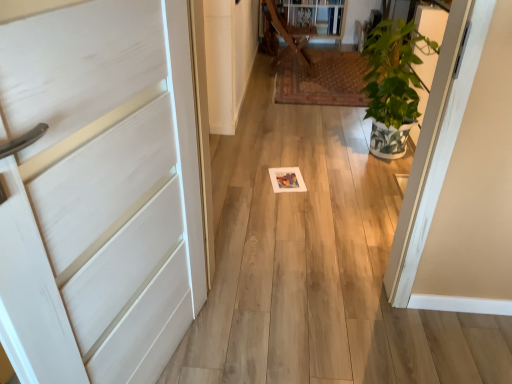
Measure the distance between point [63,294] and camera.

Point [63,294] and camera are 38.23 inches apart.

What is the approximate height of wooden at center?

wooden at center is 73.30 centimeters in height.

Describe the element at coordinates (393, 84) in the screenshot. I see `green leafy plant at right` at that location.

At what (x,y) coordinates should I click in order to perform the action: click on white matte door at left. Please return your answer as a coordinate pair (x, y). This screenshot has height=384, width=512. Looking at the image, I should click on point(99,192).

Considering the sizes of objects green leafy plant at right and white matte door at left in the image provided, who is shorter, green leafy plant at right or white matte door at left?

green leafy plant at right.

Is green leafy plant at right situated inside white matte door at left or outside?

green leafy plant at right exists outside the volume of white matte door at left.

You are a GUI agent. You are given a task and a screenshot of the screen. Output one action in this format:
    pyautogui.click(x=<x>, y=<y>)
    Task: Click on the door to the left of green leafy plant at right
    
    Given the screenshot: What is the action you would take?
    pyautogui.click(x=99, y=192)

Is white matte door at left taller or shorter than green leafy plant at right?

white matte door at left is taller than green leafy plant at right.

From the image's perspective, relative to green leafy plant at right, is white matte door at left above or below?

white matte door at left is below green leafy plant at right.

Which is more to the left, white matte door at left or green leafy plant at right?

white matte door at left is more to the left.

Is green leafy plant at right to the left of wooden at center from the viewer's perspective?

No, green leafy plant at right is not to the left of wooden at center.

Considering the positions of objects green leafy plant at right and wooden at center in the image provided, who is in front, green leafy plant at right or wooden at center?

green leafy plant at right.

Is green leafy plant at right positioned with its back to wooden at center?

That's not correct — green leafy plant at right is not looking away from wooden at center.

Consider the image. Could you tell me if white matte door at left is facing wooden at center?

No, white matte door at left is not aimed at wooden at center.

In order to click on door on the left of the wooden at center in this screenshot , I will do `click(99, 192)`.

Are white matte door at left and wooden at center far apart?

Yes, white matte door at left and wooden at center are quite far apart.

Which object is positioned more to the left, wooden at center or white matte door at left?

Positioned to the left is white matte door at left.

Which of these two, wooden at center or white matte door at left, is thinner?

With smaller width is white matte door at left.

Where is `door that is below the wooden at center (from the image's perspective)`? This screenshot has width=512, height=384. door that is below the wooden at center (from the image's perspective) is located at coordinates (99, 192).

Looking at the image, does wooden at center seem bigger or smaller compared to green leafy plant at right?

In the image, wooden at center appears to be larger than green leafy plant at right.

Is wooden at center completely or partially outside of green leafy plant at right?

Indeed, wooden at center is completely outside green leafy plant at right.

From a real-world perspective, is wooden at center on top of green leafy plant at right?

No, from a real-world perspective, wooden at center is not over green leafy plant at right

The image size is (512, 384). What are the coordinates of `door below the green leafy plant at right (from the image's perspective)` in the screenshot? It's located at (99, 192).

The height and width of the screenshot is (384, 512). Find the location of `houseplant behind the white matte door at left`. houseplant behind the white matte door at left is located at coordinates (393, 84).

Based on their spatial positions, is green leafy plant at right or wooden at center further from white matte door at left?

wooden at center.

When comparing their distances from white matte door at left, does wooden at center or green leafy plant at right seem further?

The object further to white matte door at left is wooden at center.

Estimate the real-world distances between objects in this image. Which object is further from green leafy plant at right, wooden at center or white matte door at left?

Based on the image, white matte door at left appears to be further to green leafy plant at right.

From the image, which object appears to be nearer to wooden at center, green leafy plant at right or white matte door at left?

green leafy plant at right.

Which object lies nearer to the anchor point wooden at center, white matte door at left or green leafy plant at right?

green leafy plant at right.

Considering their positions, is white matte door at left positioned further to green leafy plant at right than wooden at center?

white matte door at left lies further to green leafy plant at right than the other object.

Locate an element on the screen. houseplant between white matte door at left and wooden at center along the z-axis is located at coordinates (393, 84).